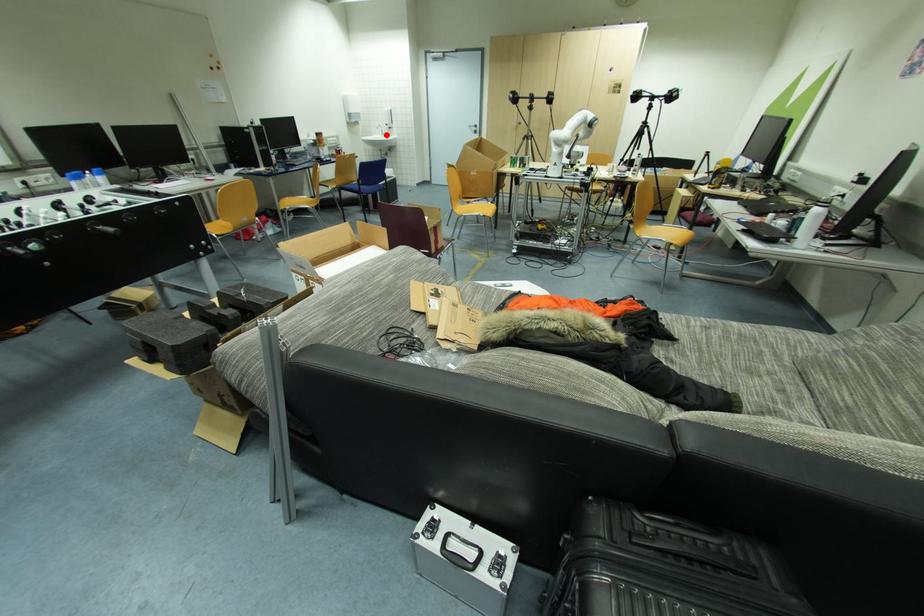
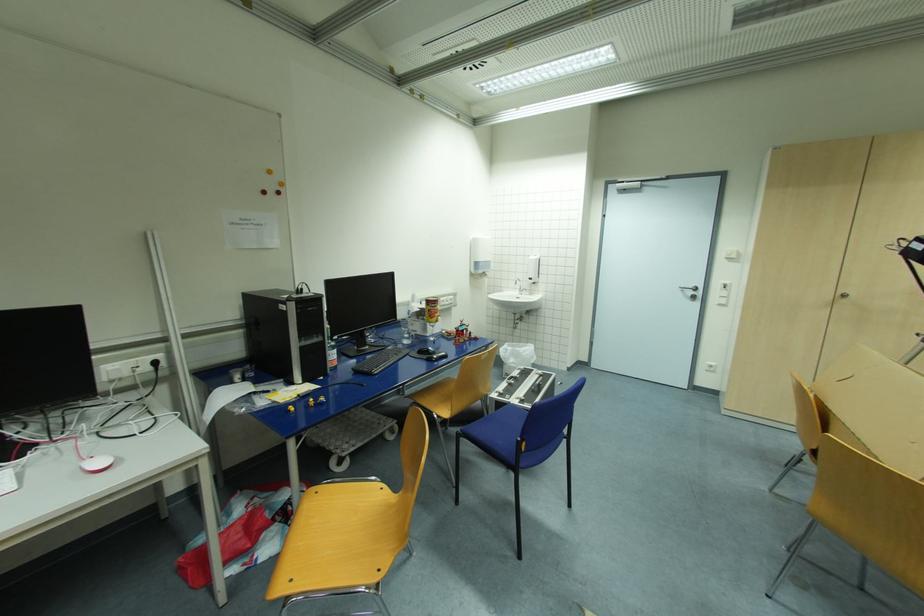
In the second image, find the point that corresponds to the highlighted location in the first image.

(525, 291)